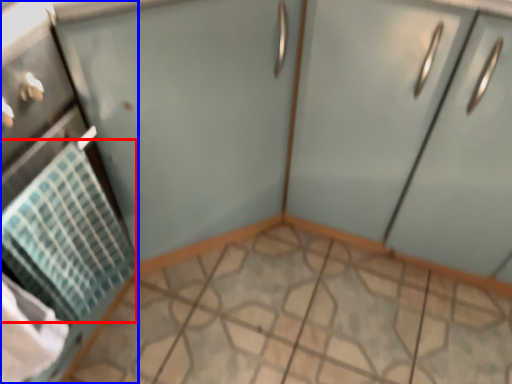
Question: Among these objects, which one is nearest to the camera, blanket (highlighted by a red box) or appliance (highlighted by a blue box)?

Choices:
 (A) blanket
 (B) appliance

Answer: (B)